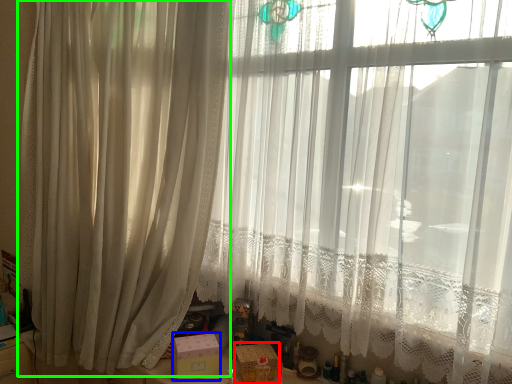
Question: Estimate the real-world distances between objects in this image. Which object is farther from box (highlighted by a red box), box (highlighted by a blue box) or curtain (highlighted by a green box)?

Choices:
 (A) box
 (B) curtain

Answer: (B)